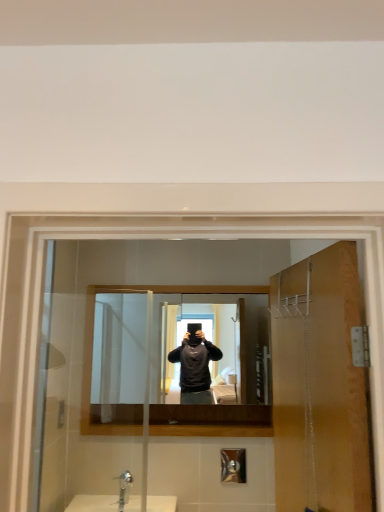
Question: Can you confirm if matte black mirror at center is thinner than silver metallic faucet at lower center?

Choices:
 (A) no
 (B) yes

Answer: (B)

Question: Is matte black mirror at center oriented away from silver metallic faucet at lower center?

Choices:
 (A) yes
 (B) no

Answer: (B)

Question: Is silver metallic faucet at lower center a part of matte black mirror at center?

Choices:
 (A) no
 (B) yes

Answer: (A)

Question: Considering the relative positions of matte black mirror at center and silver metallic faucet at lower center in the image provided, is matte black mirror at center in front of silver metallic faucet at lower center?

Choices:
 (A) no
 (B) yes

Answer: (A)

Question: From a real-world perspective, is matte black mirror at center under silver metallic faucet at lower center?

Choices:
 (A) yes
 (B) no

Answer: (B)

Question: Can you confirm if matte black mirror at center is shorter than silver metallic faucet at lower center?

Choices:
 (A) no
 (B) yes

Answer: (A)

Question: Can we say silver metallic faucet at lower center lies outside matte black mirror at center?

Choices:
 (A) yes
 (B) no

Answer: (A)

Question: From a real-world perspective, is silver metallic faucet at lower center under matte black mirror at center?

Choices:
 (A) yes
 (B) no

Answer: (A)

Question: Is silver metallic faucet at lower center to the left of matte black mirror at center from the viewer's perspective?

Choices:
 (A) no
 (B) yes

Answer: (B)

Question: Does silver metallic faucet at lower center turn towards matte black mirror at center?

Choices:
 (A) no
 (B) yes

Answer: (A)

Question: Does silver metallic faucet at lower center have a greater height compared to matte black mirror at center?

Choices:
 (A) yes
 (B) no

Answer: (B)

Question: From a real-world perspective, is silver metallic faucet at lower center over matte black mirror at center?

Choices:
 (A) no
 (B) yes

Answer: (A)

Question: Is matte black mirror at center to the left of brushed metal shower at lower center from the viewer's perspective?

Choices:
 (A) no
 (B) yes

Answer: (B)